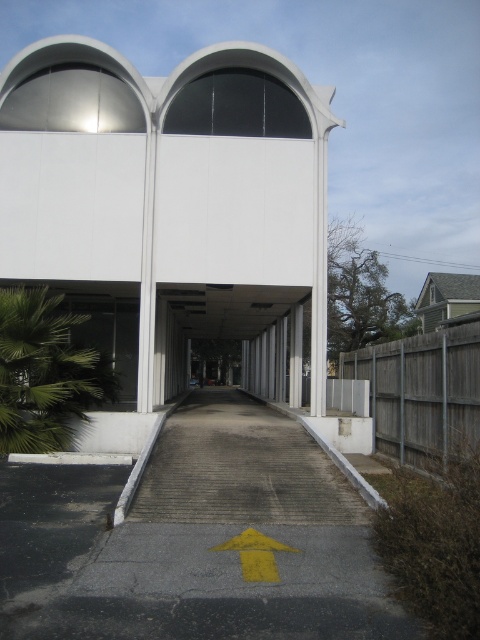
Between point (471, 401) and point (249, 550), which one is positioned behind?

Point (471, 401)

Does point (460, 372) come closer to viewer compared to point (243, 545)?

No, (460, 372) is behind (243, 545).

Describe the element at coordinates (421, 394) in the screenshot. This screenshot has height=640, width=480. I see `wooden fence at right` at that location.

You are a GUI agent. You are given a task and a screenshot of the screen. Output one action in this format:
    pyautogui.click(x=<x>, y=<y>)
    Task: Click on the wooden fence at right
    The height and width of the screenshot is (640, 480).
    Given the screenshot: What is the action you would take?
    pyautogui.click(x=421, y=394)